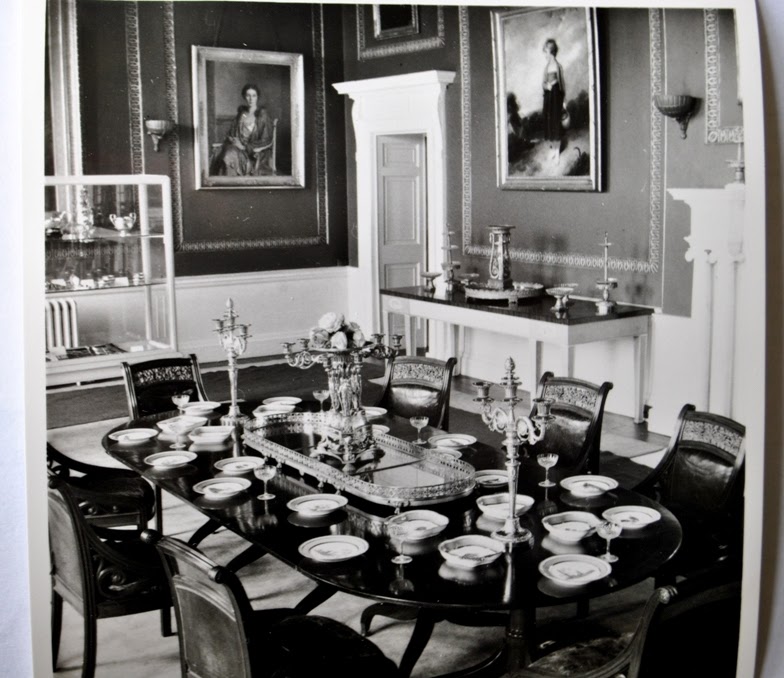
You are a GUI agent. You are given a task and a screenshot of the screen. Output one action in this format:
    pyautogui.click(x=<x>, y=<y>)
    Task: Click on the door
    
    Given the screenshot: What is the action you would take?
    pyautogui.click(x=411, y=222)